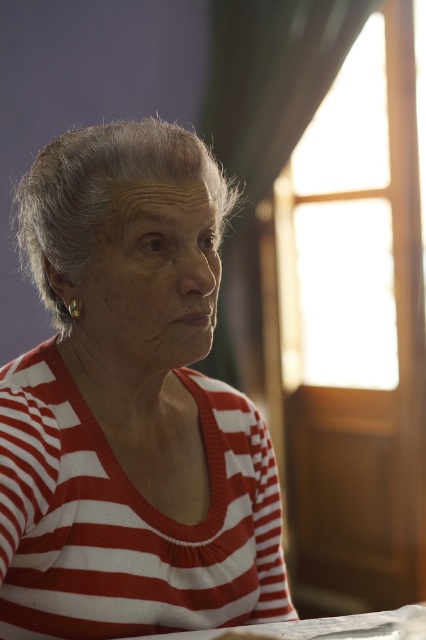
Is red striped sweater at center bigger than white paper at lower center?

Yes, red striped sweater at center is bigger than white paper at lower center.

Can you confirm if red striped sweater at center is positioned to the right of white paper at lower center?

Incorrect, red striped sweater at center is not on the right side of white paper at lower center.

At what (x,y) coordinates should I click in order to perform the action: click on red striped sweater at center. Please return your answer as a coordinate pair (x, y). The width and height of the screenshot is (426, 640). Looking at the image, I should click on (131, 404).

Identify the location of red striped sweater at center. click(131, 404).